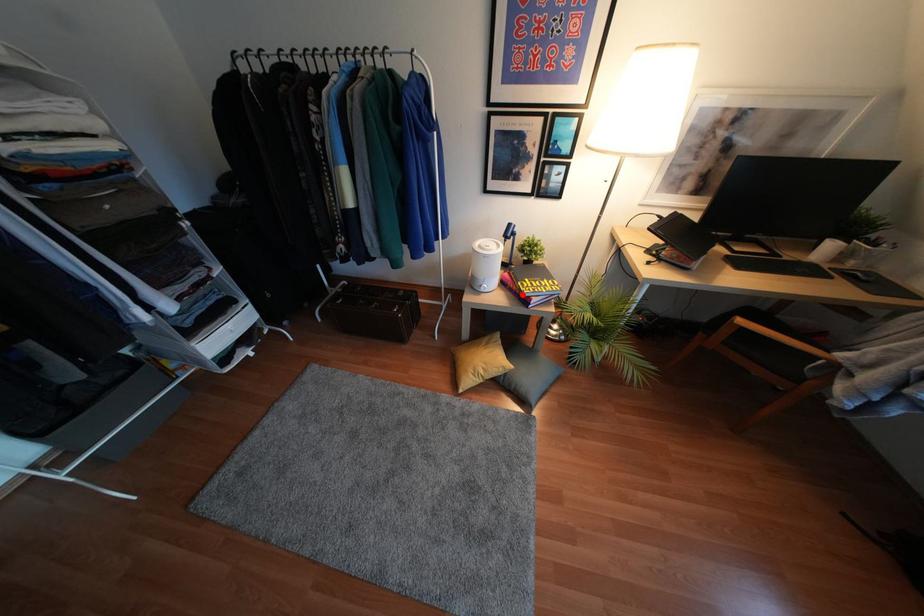
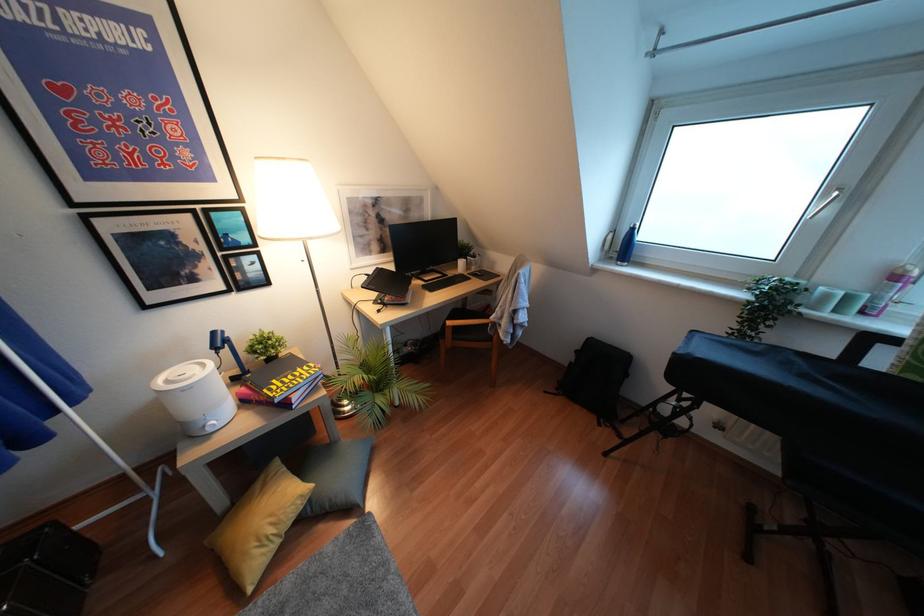
Question: I am providing you with two images of the same scene from different viewpoints. In image1, a red point is highlighted. Considering the same 3D point in image2, which of the following is correct?

Choices:
 (A) It is closer
 (B) It is farther

Answer: (B)